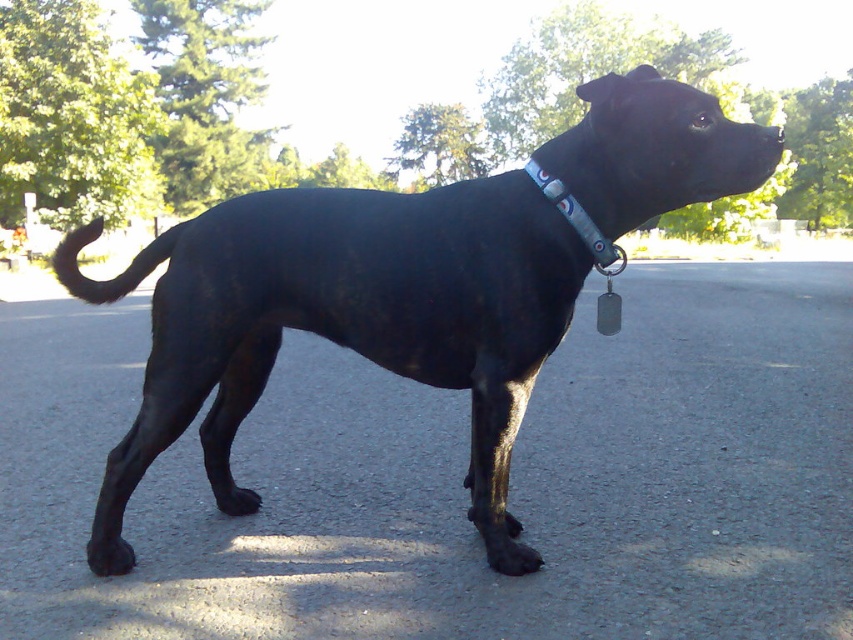
The width and height of the screenshot is (853, 640). What do you see at coordinates (344, 321) in the screenshot?
I see `black smooth dog at center` at bounding box center [344, 321].

Is black smooth dog at center wider than blue fabric collar at upper center?

Yes, black smooth dog at center is wider than blue fabric collar at upper center.

Locate an element on the screen. The height and width of the screenshot is (640, 853). black smooth dog at center is located at coordinates (344, 321).

Where is `black smooth dog at center`? The height and width of the screenshot is (640, 853). black smooth dog at center is located at coordinates (344, 321).